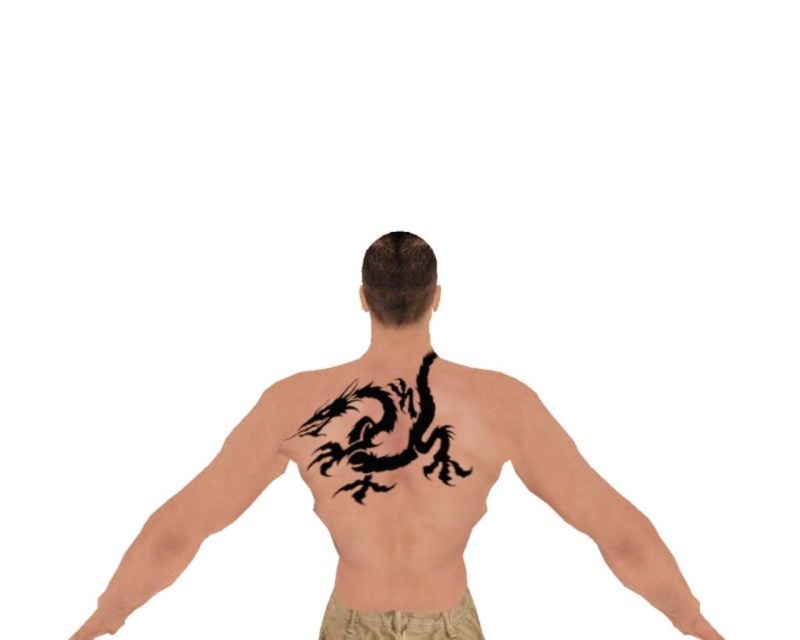
You are a tattoo artist observing the person from the front. You need to apply a temporary tattoo on the area that is farther from your view. Which object should you choose between the black ink dragon at center and the tan fabric shorts at lower center?

The tan fabric shorts at lower center are farther from the viewer than the black ink dragon at center, so you should apply the temporary tattoo on the tan fabric shorts at lower center.

You are an artist trying to replicate the tattoo design. You need to know which part of the tattoo is wider. Based on the scene, which is wider between the black ink tattoo at upper left and the black ink dragon at center?

The black ink tattoo at upper left is wider than the black ink dragon at center according to the description.

You are an artist trying to sketch the scene. You notice the smooth skin at right and the black ink dragon at center. Which object is positioned lower in the image?

The smooth skin at right is located below the black ink dragon at center, so it is positioned lower in the image.